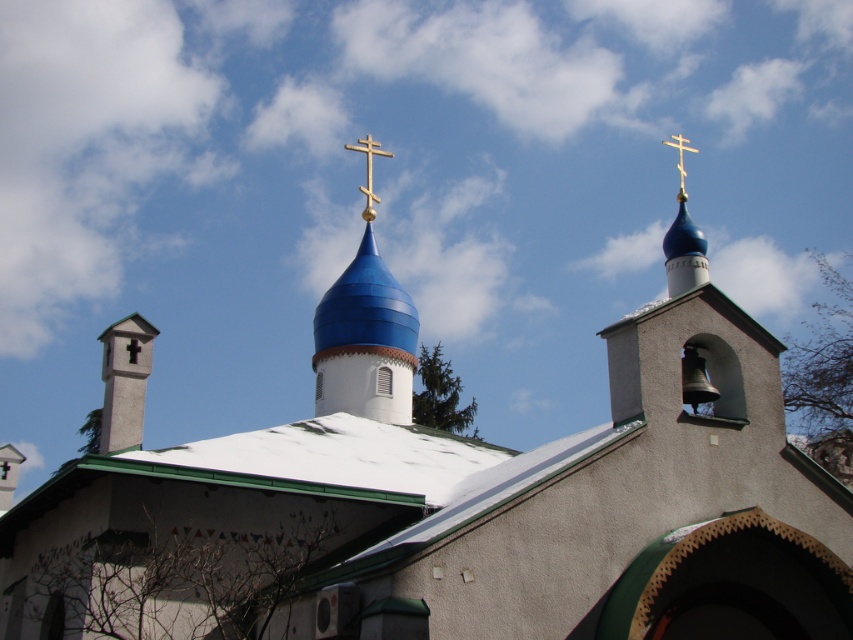
Who is more forward, (374, 196) or (679, 141)?

Point (374, 196)

What are the coordinates of `gold metallic cross at upper center` in the screenshot? It's located at (368, 172).

Where is `gold metallic cross at upper center`? gold metallic cross at upper center is located at coordinates (368, 172).